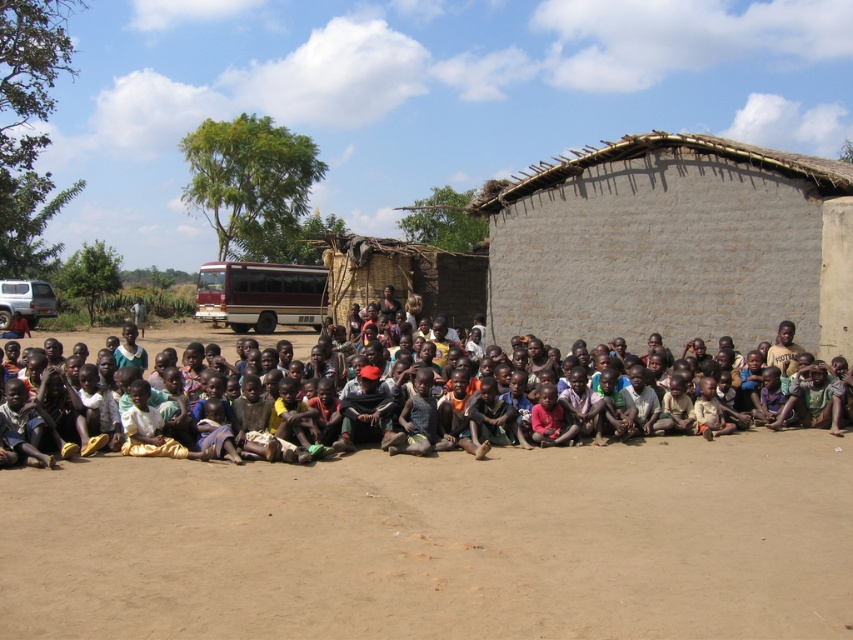
You are standing in front of the rustic building and want to place two markers at the coordinates point (619, 262) and point (62, 346). From your perspective, which marker will be closer to the building?

Point (619, 262) is in front of point (62, 346), so the marker at point (619, 262) will be closer to the building.

You are a photographer standing in front of the rustic building and want to capture both the point at coordinates point (846,499) and point (849,436) in your photo. Which point will appear larger in your photo?

Point (846,499) is closer to the camera than point (849,436), so it will appear larger in the photo.